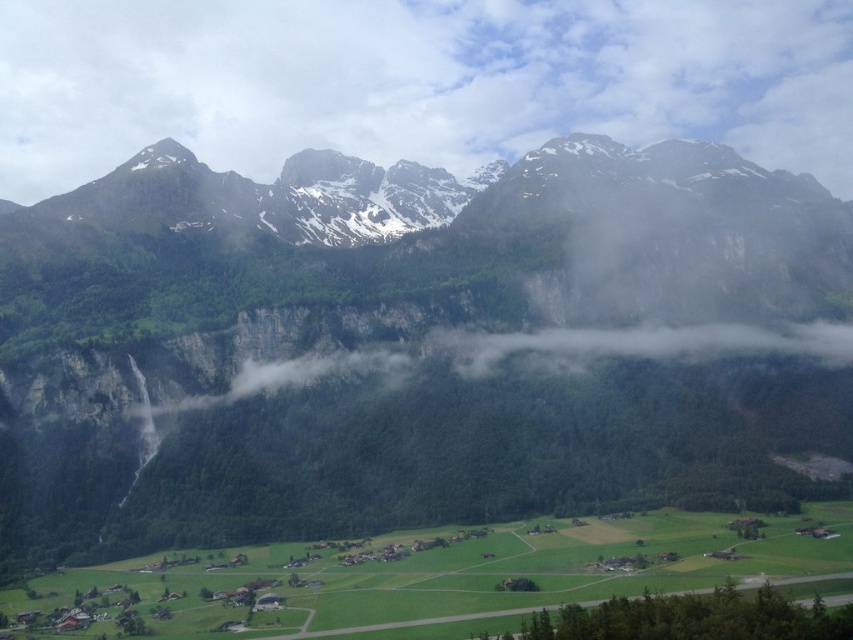
Is the position of green rocky mountain range at upper center less distant than that of white fluffy cloud at upper center?

That is True.

Is point (799, 260) less distant than point (305, 141)?

Yes, it is.

Identify the location of green rocky mountain range at upper center. (412, 346).